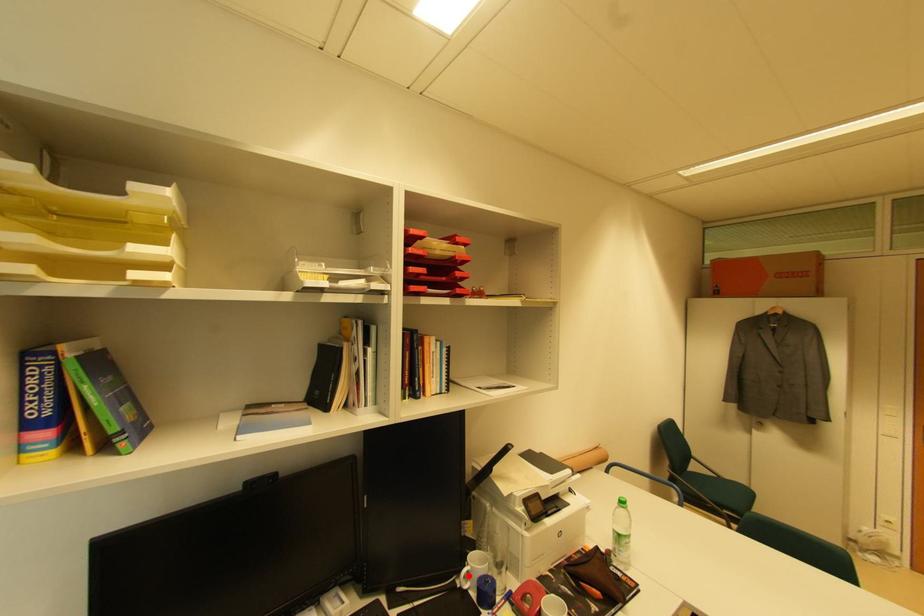
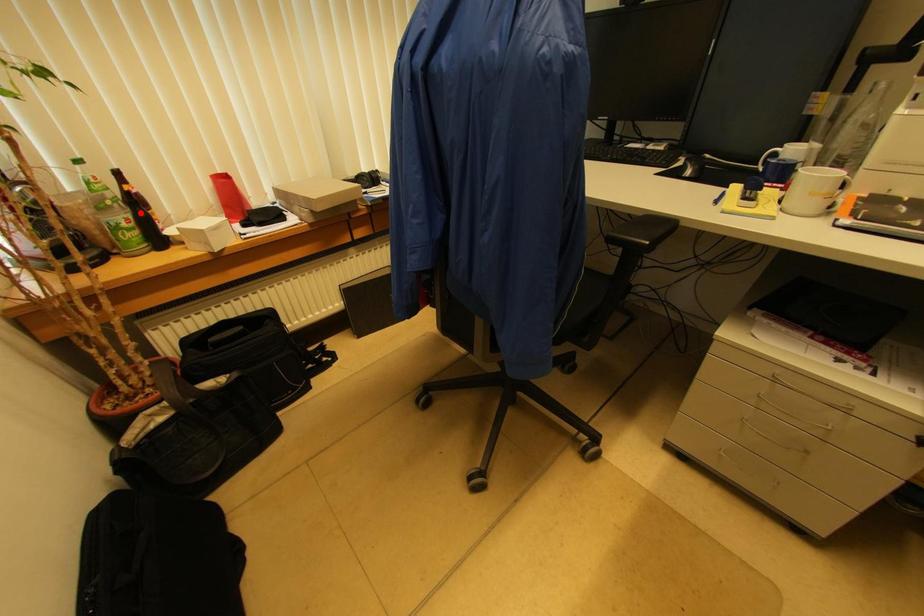
I am providing you with two images of the same scene from different viewpoints. A red point is marked on the first image and another point is marked on the second image. Are the points marked in image1 and image2 representing the same 3D position?

No